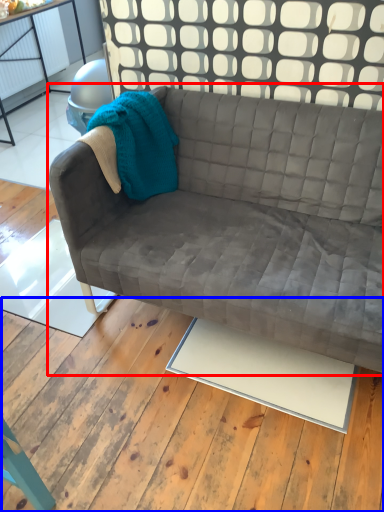
Question: Which of the following is the closest to the observer, studio couch (highlighted by a red box) or plywood (highlighted by a blue box)?

Choices:
 (A) studio couch
 (B) plywood

Answer: (B)